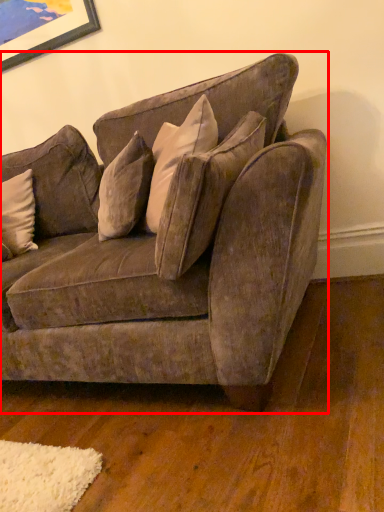
Question: From the image's perspective, where is studio couch (annotated by the red box) located in relation to pillow in the image?

Choices:
 (A) below
 (B) above

Answer: (A)